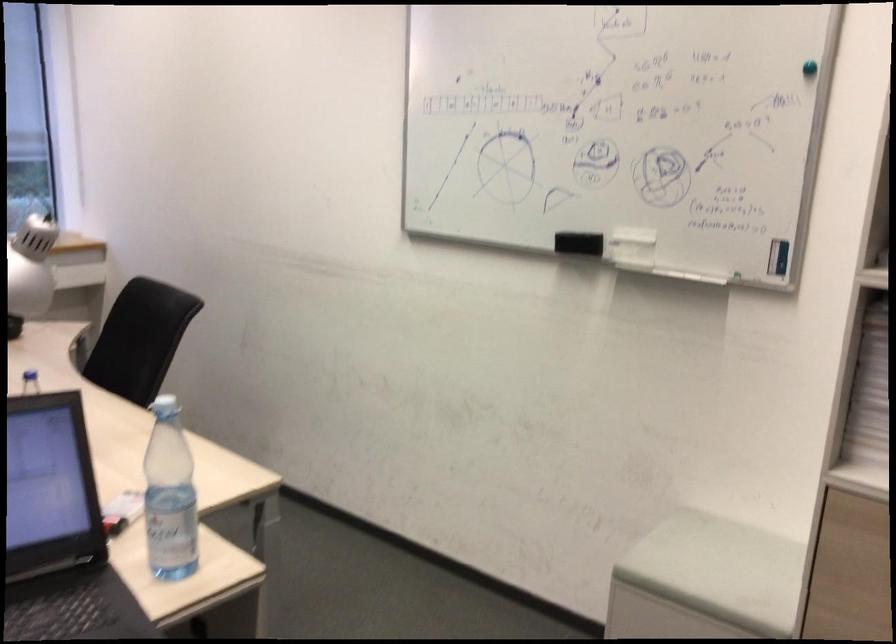
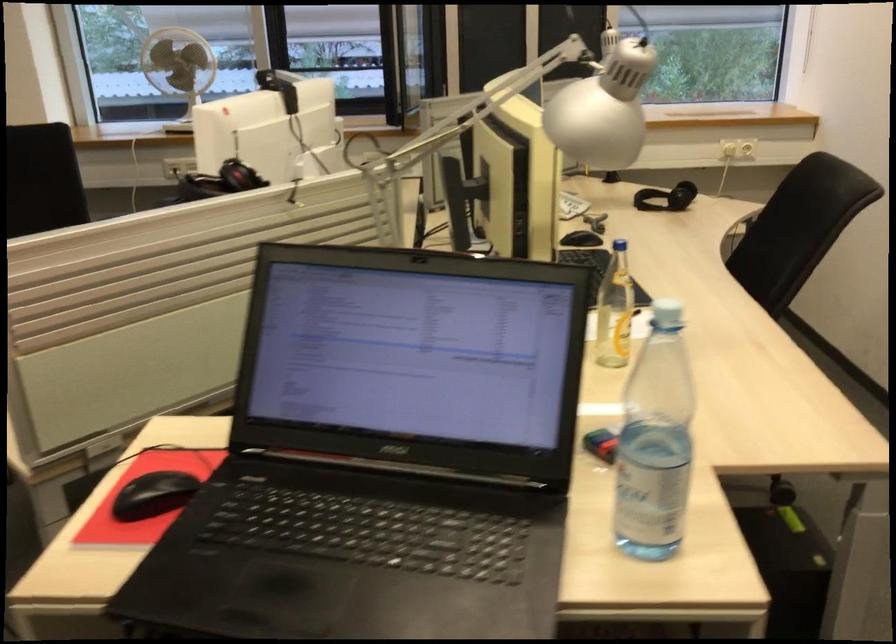
The point at [168,404] is marked in the first image. Where is the corresponding point in the second image?

(666, 313)